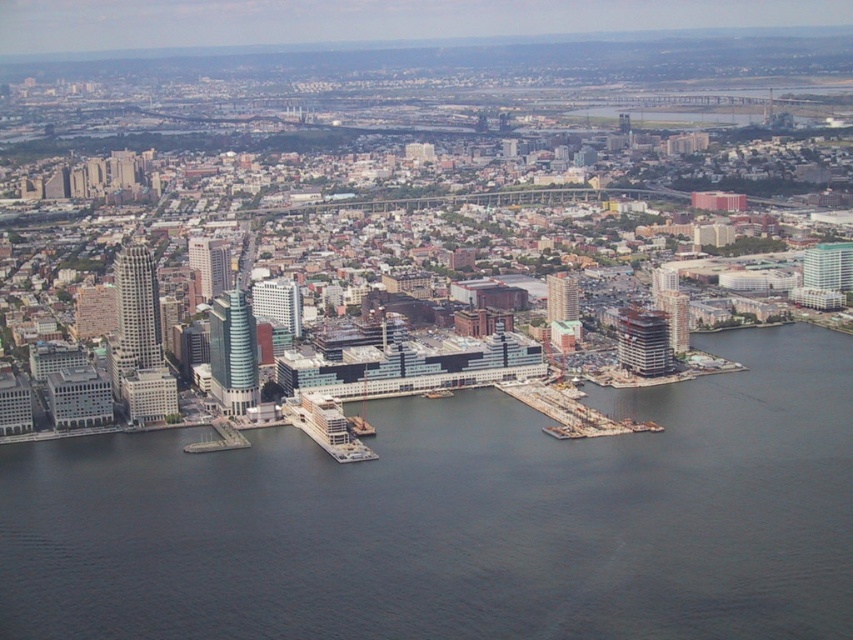
Is wooden planks dock at lower right positioned at the back of concrete dock at lower left?

No, it is not.

Is point (524, 390) more distant than point (228, 433)?

That is False.

At what (x,y) coordinates should I click in order to perform the action: click on wooden planks dock at lower right. Please return your answer as a coordinate pair (x, y). The width and height of the screenshot is (853, 640). Looking at the image, I should click on (569, 412).

Is the position of dark blue water at center more distant than that of concrete dock at lower left?

No.

Who is higher up, dark blue water at center or concrete dock at lower left?

concrete dock at lower left is higher up.

Describe the element at coordinates (461, 518) in the screenshot. This screenshot has width=853, height=640. I see `dark blue water at center` at that location.

At what (x,y) coordinates should I click in order to perform the action: click on dark blue water at center. Please return your answer as a coordinate pair (x, y). The height and width of the screenshot is (640, 853). Looking at the image, I should click on (461, 518).

Who is taller, dark blue water at center or wooden planks dock at lower right?

With more height is dark blue water at center.

Identify the location of dark blue water at center. The image size is (853, 640). (461, 518).

Is point (496, 636) in front of point (544, 385)?

No, it is not.

This screenshot has width=853, height=640. I want to click on dark blue water at center, so click(461, 518).